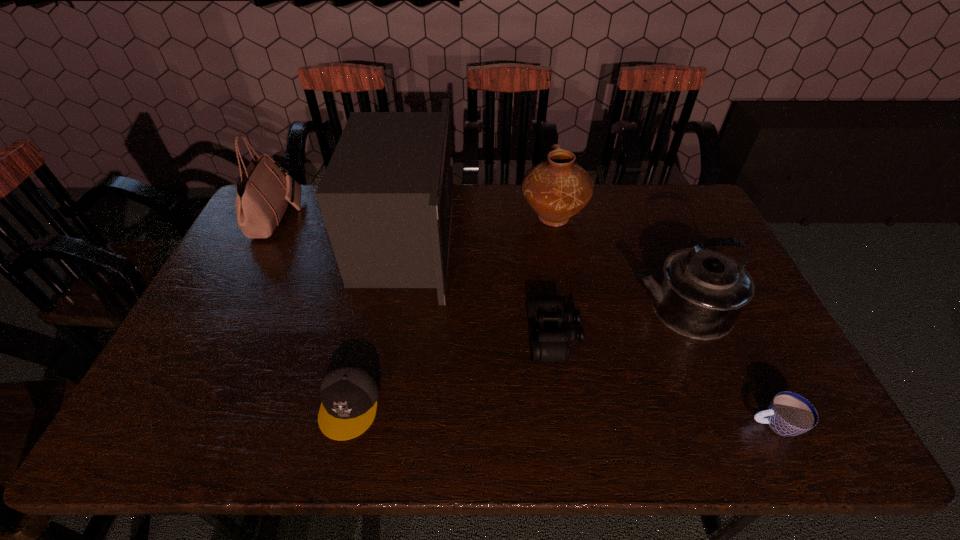
Where is `pottery that is positioned at the far edge`? Image resolution: width=960 pixels, height=540 pixels. pottery that is positioned at the far edge is located at coordinates (557, 188).

Image resolution: width=960 pixels, height=540 pixels. I want to click on cap positioned at the near edge, so click(x=349, y=392).

Where is `cup situated at the near edge`? This screenshot has height=540, width=960. cup situated at the near edge is located at coordinates (789, 414).

I want to click on object located at the left edge, so click(264, 191).

Find the location of a particular element. The image size is (960, 540). kettle that is positioned at the right edge is located at coordinates (700, 293).

Identify the location of cup that is at the right edge. (789, 414).

This screenshot has height=540, width=960. I want to click on object that is at the far left corner, so click(264, 191).

The height and width of the screenshot is (540, 960). Find the location of `object that is at the near right corner`. object that is at the near right corner is located at coordinates (789, 414).

The image size is (960, 540). Find the location of `free region at the far edge of the desktop`. free region at the far edge of the desktop is located at coordinates (612, 201).

In the image, there is a desktop. Where is `free space at the near edge`? free space at the near edge is located at coordinates (716, 423).